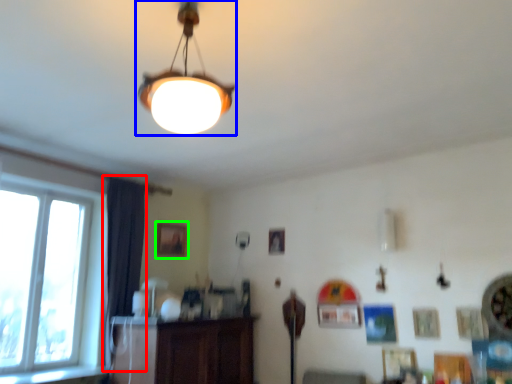
Question: Which is farther away from curtain (highlighted by a red box)? lamp (highlighted by a blue box) or picture frame (highlighted by a green box)?

Choices:
 (A) lamp
 (B) picture frame

Answer: (A)